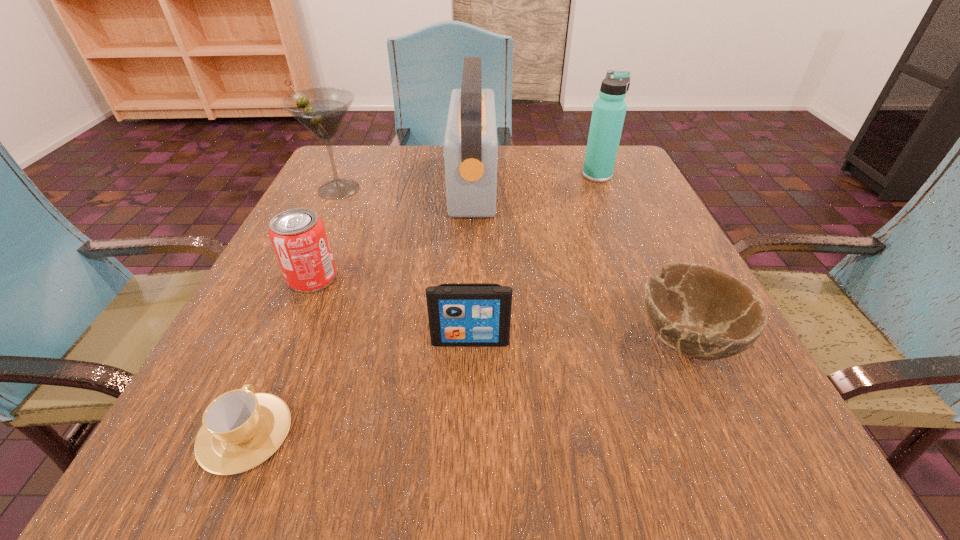
The height and width of the screenshot is (540, 960). What are the coordinates of `free spot located on the right of the martini` in the screenshot? It's located at (465, 189).

In order to click on vacant space situated on the right of the can in this screenshot , I will do `click(442, 278)`.

At what (x,y) coordinates should I click in order to perform the action: click on free space located on the front screen of the iPod. Please return your answer as a coordinate pair (x, y). This screenshot has width=960, height=540. Looking at the image, I should click on (468, 469).

At what (x,y) coordinates should I click in order to perform the action: click on vacant space located on the left of the bowl. Please return your answer as a coordinate pair (x, y). This screenshot has height=540, width=960. Looking at the image, I should click on pyautogui.click(x=560, y=339).

The width and height of the screenshot is (960, 540). What are the coordinates of `vacant space located 0.110m with the handle on the side of the nearest object` in the screenshot? It's located at (289, 332).

Locate an element on the screen. This screenshot has height=540, width=960. vacant region located with the handle on the side of the nearest object is located at coordinates (279, 353).

Identify the location of vacant point located 0.270m with the handle on the side of the nearest object. Image resolution: width=960 pixels, height=540 pixels. (318, 265).

Where is `radio receiver that is at the far edge`? radio receiver that is at the far edge is located at coordinates (470, 146).

Where is `thermos bottle situated at the far edge`? The height and width of the screenshot is (540, 960). thermos bottle situated at the far edge is located at coordinates (609, 110).

Locate an element on the screen. Image resolution: width=960 pixels, height=540 pixels. martini that is positioned at the far edge is located at coordinates (322, 110).